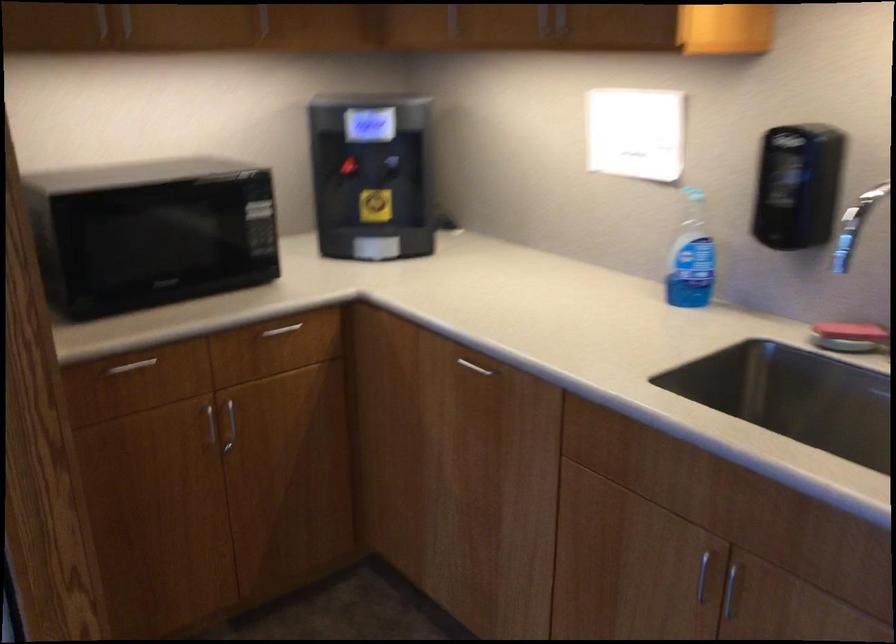
Find where to push the red water cooler lever. Please return your answer as a coordinate pair (x, y).

(345, 167)